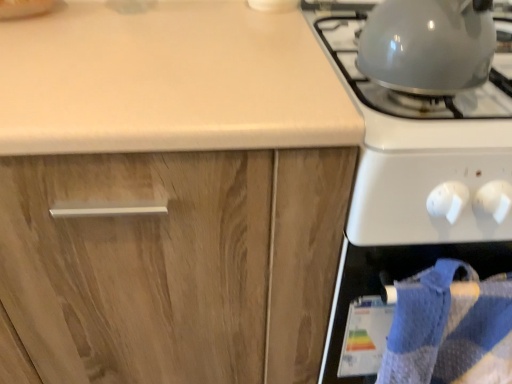
The image size is (512, 384). In order to click on blank space above wooden cabinet at center (from a real-world perspective) in this screenshot , I will do `click(128, 48)`.